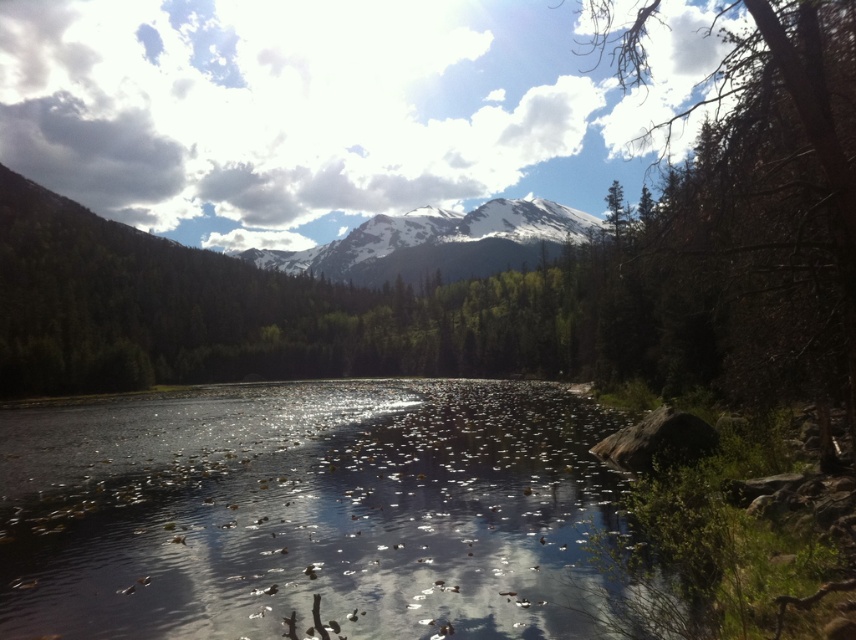
Question: Which object is closer to the camera taking this photo?

Choices:
 (A) translucent water at center
 (B) snowy white mountain at center
 (C) green leafy tree at center

Answer: (C)

Question: Considering the relative positions of green leafy tree at center and snowy white mountain at center in the image provided, where is green leafy tree at center located with respect to snowy white mountain at center?

Choices:
 (A) left
 (B) right

Answer: (B)

Question: Which is farther from the snowy white mountain at center?

Choices:
 (A) translucent water at center
 (B) green leafy tree at center

Answer: (A)

Question: Considering the relative positions of translucent water at center and snowy white mountain at center in the image provided, where is translucent water at center located with respect to snowy white mountain at center?

Choices:
 (A) left
 (B) right

Answer: (A)

Question: Which object is closer to the camera taking this photo?

Choices:
 (A) green leafy tree at center
 (B) snowy white mountain at center

Answer: (A)

Question: Does green leafy tree at center come in front of snowy white mountain at center?

Choices:
 (A) yes
 (B) no

Answer: (A)